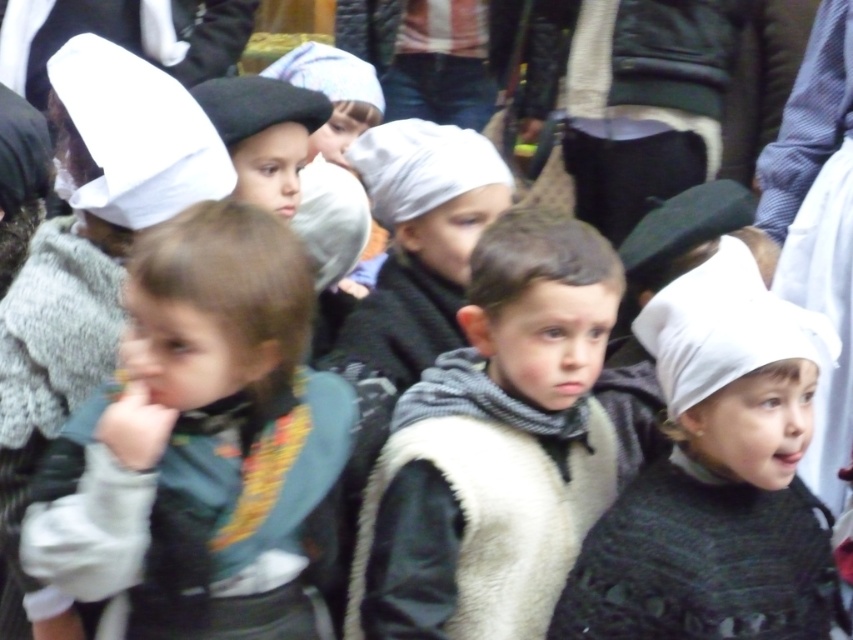
Based on the photo, who is more distant from viewer, [157,445] or [576,609]?

Positioned behind is point [576,609].

Can you confirm if dark green sweater at center is positioned below white knitted hat at center?

Actually, dark green sweater at center is above white knitted hat at center.

Locate an element on the screen. dark green sweater at center is located at coordinates (198, 442).

The height and width of the screenshot is (640, 853). What are the coordinates of `dark green sweater at center` in the screenshot? It's located at (198, 442).

What do you see at coordinates (198, 442) in the screenshot? This screenshot has width=853, height=640. I see `dark green sweater at center` at bounding box center [198, 442].

Does dark green sweater at center have a smaller size compared to knitted gray scarf at center?

Yes.

Is point (212, 506) in front of point (404, 432)?

That is True.

I want to click on dark green sweater at center, so click(198, 442).

Does knitted gray scarf at center appear over white knitted hat at center?

No, knitted gray scarf at center is not above white knitted hat at center.

Is knitted gray scarf at center positioned in front of white knitted hat at center?

Yes.

Who is more forward, [579,540] or [564,624]?

Positioned in front is point [564,624].

Find the location of a particular element. The image size is (853, 640). knitted gray scarf at center is located at coordinates (496, 445).